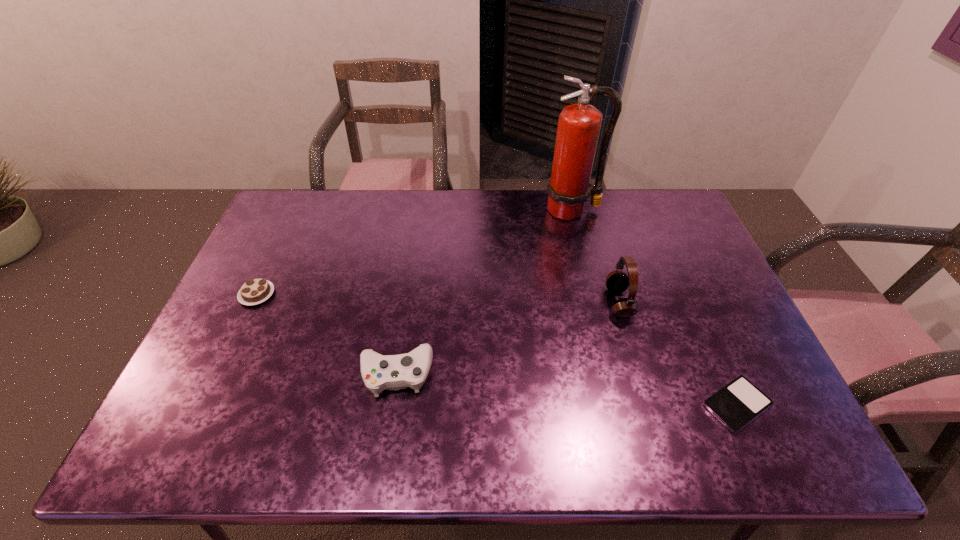
This screenshot has height=540, width=960. In order to click on the tallest object in this screenshot , I will do `click(579, 125)`.

The image size is (960, 540). In order to click on the farthest object in this screenshot , I will do `click(579, 125)`.

I want to click on the second tallest object, so click(617, 281).

This screenshot has width=960, height=540. Identify the location of the third shortest object. (394, 372).

Locate an element on the screen. This screenshot has width=960, height=540. the fourth object from right to left is located at coordinates (394, 372).

Locate an element on the screen. chocolate cake is located at coordinates (254, 291).

Identify the location of the leftmost object. (254, 291).

Where is `the shortest object`? This screenshot has width=960, height=540. the shortest object is located at coordinates (739, 402).

You are a GUI agent. You are given a task and a screenshot of the screen. Output one action in this format:
    pyautogui.click(x=<x>, y=<y>)
    Task: Click on the iPod
    
    Given the screenshot: What is the action you would take?
    pyautogui.click(x=739, y=402)

This screenshot has width=960, height=540. I want to click on free region located 0.350m at the nozzle of the farthest object, so click(x=593, y=299).